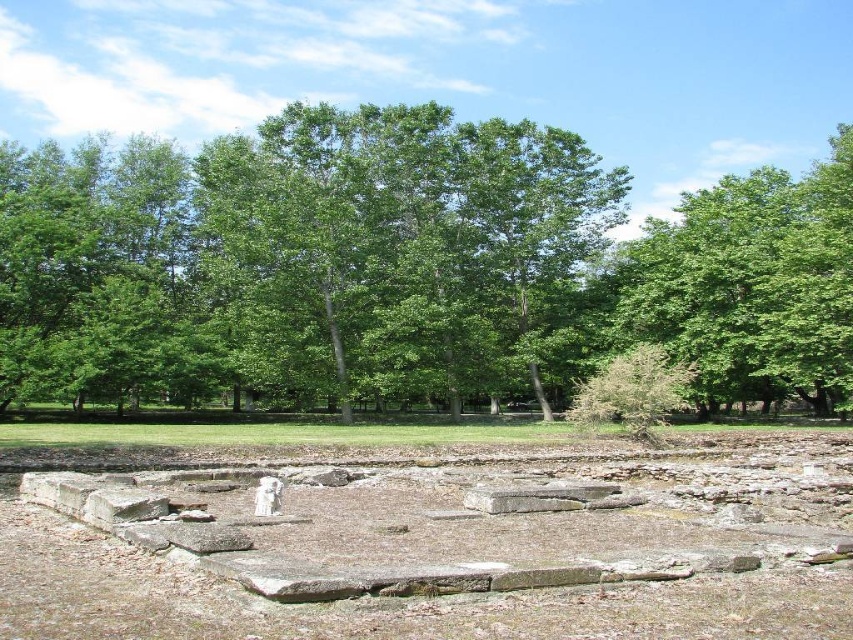
You are an archaeologist standing at the edge of the archaeological site. You see the green leafy tree at center and the brown stone dirt field at center. Which object is located to the right of the other?

The green leafy tree at center is positioned on the right side of brown stone dirt field at center, so the green leafy tree at center is to the right of the brown stone dirt field at center.

You are standing at the point marked by the coordinates point (407, 268) in the archaeological site. Looking around, what structure or feature is immediately visible from this location?

The green leafy tree at center is located at point (407, 268), so standing there, you would immediately see the green leafy tree at center.